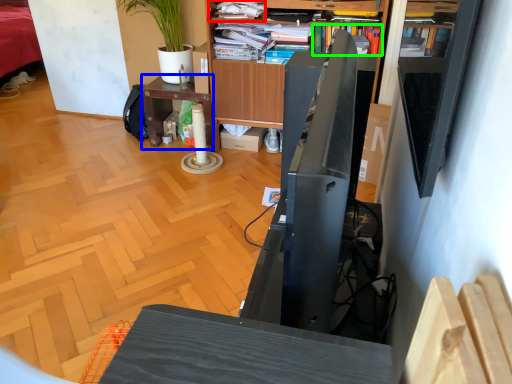
Question: Which object is the farthest from shelf (highlighted by a red box)? Choose among these: desk (highlighted by a blue box) or book (highlighted by a green box).

Choices:
 (A) desk
 (B) book

Answer: (A)